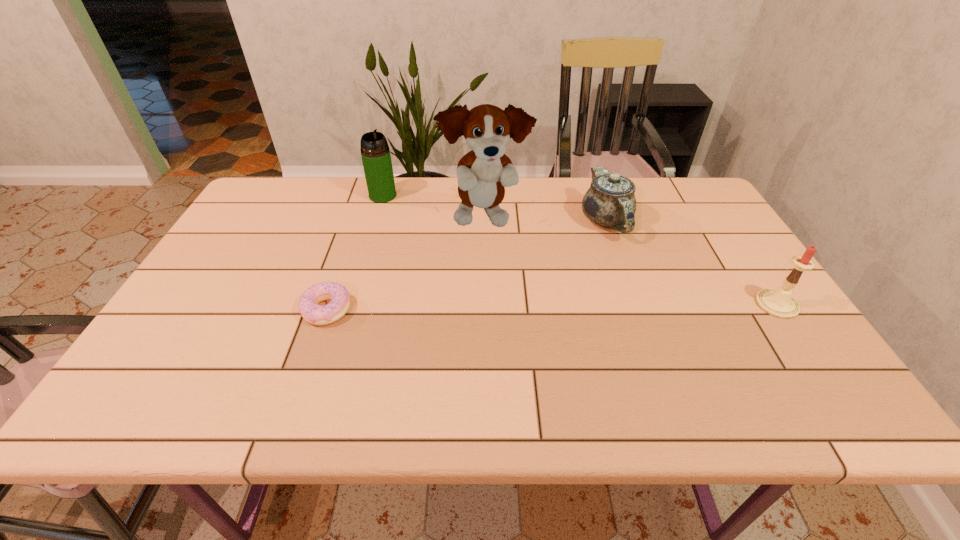
Identify the location of doughnut. (313, 313).

Identify the location of the rightmost object. (779, 303).

In order to click on puppy in this screenshot , I will do `click(482, 173)`.

The width and height of the screenshot is (960, 540). What are the coordinates of `the tallest object` in the screenshot? It's located at (482, 173).

I want to click on the fourth shortest object, so click(375, 152).

Where is `the second shortest object`? the second shortest object is located at coordinates (610, 202).

Find the location of a particular element. The height and width of the screenshot is (540, 960). chinaware is located at coordinates (610, 202).

This screenshot has width=960, height=540. I want to click on free space located 0.110m on the front of the shortest object, so click(x=306, y=368).

Identify the location of vacant area situated on the back of the rightmost object. (735, 244).

The width and height of the screenshot is (960, 540). In order to click on vacant space located 0.060m on the face of the tallest object in this screenshot , I will do [x=508, y=255].